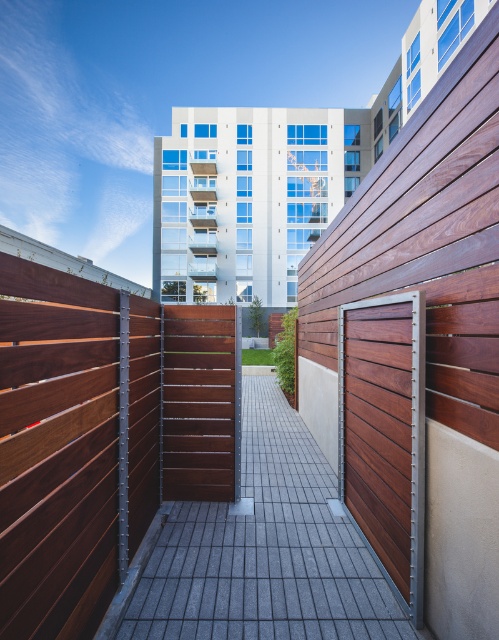
Between matte wood fence at center and smooth gray stone path at center, which one is positioned lower?

smooth gray stone path at center is below.

Is matte wood fence at center positioned before smooth gray stone path at center?

That is True.

Is point (7, 358) behind point (345, 573)?

No.

Where is `matte wood fence at center`? matte wood fence at center is located at coordinates (100, 435).

Between matte wood fence at center and wooden slats door at center, which one is positioned lower?

wooden slats door at center

Does matte wood fence at center have a larger size compared to wooden slats door at center?

Yes, matte wood fence at center is bigger than wooden slats door at center.

The height and width of the screenshot is (640, 499). Find the location of `matte wood fence at center`. matte wood fence at center is located at coordinates (100, 435).

This screenshot has height=640, width=499. I want to click on matte wood fence at center, so click(100, 435).

Which is below, smooth gray stone path at center or wooden slats door at center?

smooth gray stone path at center is lower down.

Can you confirm if smooth gray stone path at center is positioned below wooden slats door at center?

Correct, smooth gray stone path at center is located below wooden slats door at center.

Does point (213, 618) come farther from viewer compared to point (351, 369)?

That is False.

You are a GUI agent. You are given a task and a screenshot of the screen. Output one action in this format:
    pyautogui.click(x=<x>, y=<y>)
    Task: Click on the smooth gray stone path at center
    This screenshot has width=499, height=640.
    Given the screenshot: What is the action you would take?
    pyautogui.click(x=259, y=552)